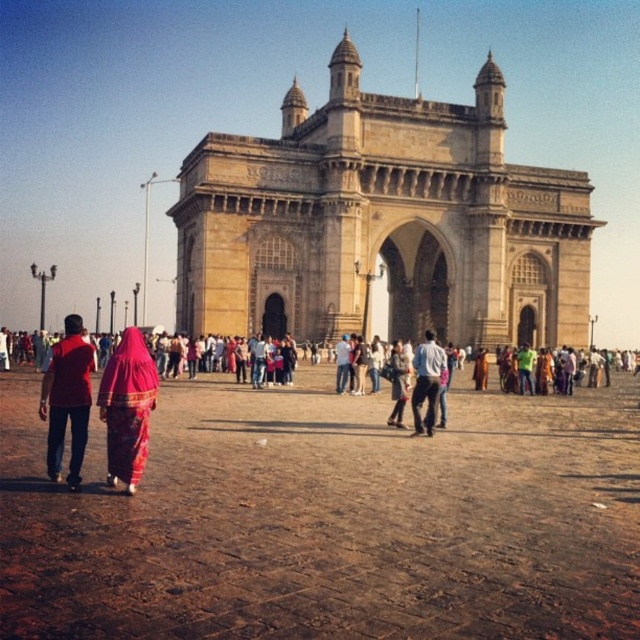
In the scene shown: You are a tourist standing in front of the Gateway of India monument. You notice a brown stone dirt field at center and a denim jacket at center. Which object is positioned to the left?

The brown stone dirt field at center is to the left of the denim jacket at center.

You are a tourist standing at the entrance of the Gateway of India. You see a brown stone dirt field at center and a denim jacket at center. Which object is wider?

The brown stone dirt field at center is wider than the denim jacket at center.

You are standing at the entrance of the Gateway of India and want to reach the brown stone dirt field at center. Which direction should you walk to get there?

The brown stone dirt field at center is located at point coordinates, so you should walk towards the center to reach it.